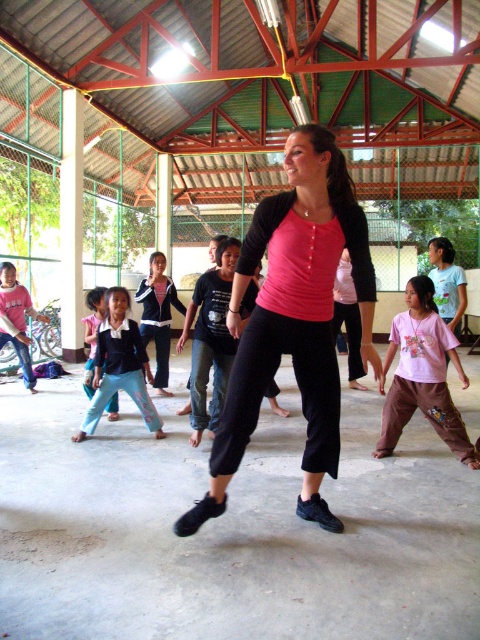
You are a photographer standing at the back of the hall. You want to take a photo that includes both the pink cotton shirt at center and the light blue cotton pants at lower left. What is the minimum distance you need to move forward to ensure both are in frame?

The minimum distance you need to move forward is 2.53 meters to ensure both the pink cotton shirt at center and the light blue cotton pants at lower left are in frame.

Where is the pink cotton shirt at center located in the image?

The pink cotton shirt at center is located at point 0.588 on the x axis and 0.879 on the y axis.